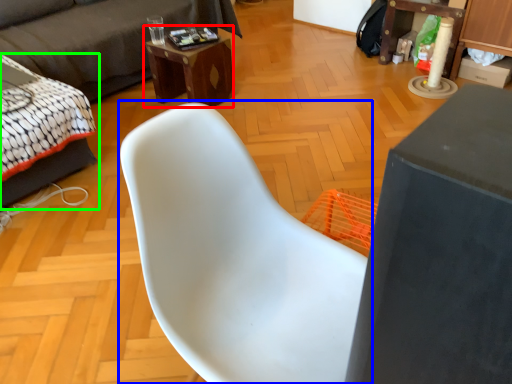
Question: Estimate the real-world distances between objects in this image. Which object is closer to desk (highlighted by a red box), chair (highlighted by a blue box) or bed (highlighted by a green box)?

Choices:
 (A) chair
 (B) bed

Answer: (B)